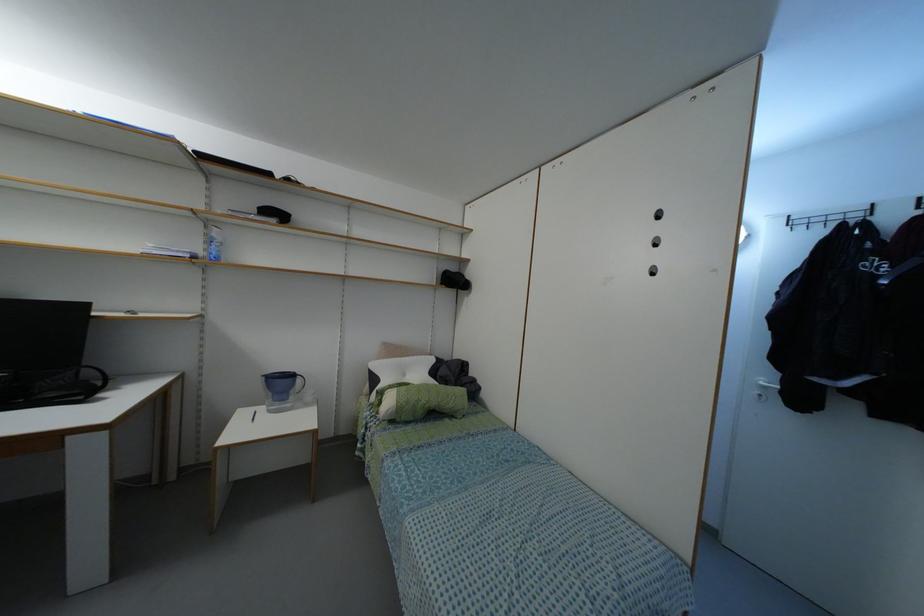
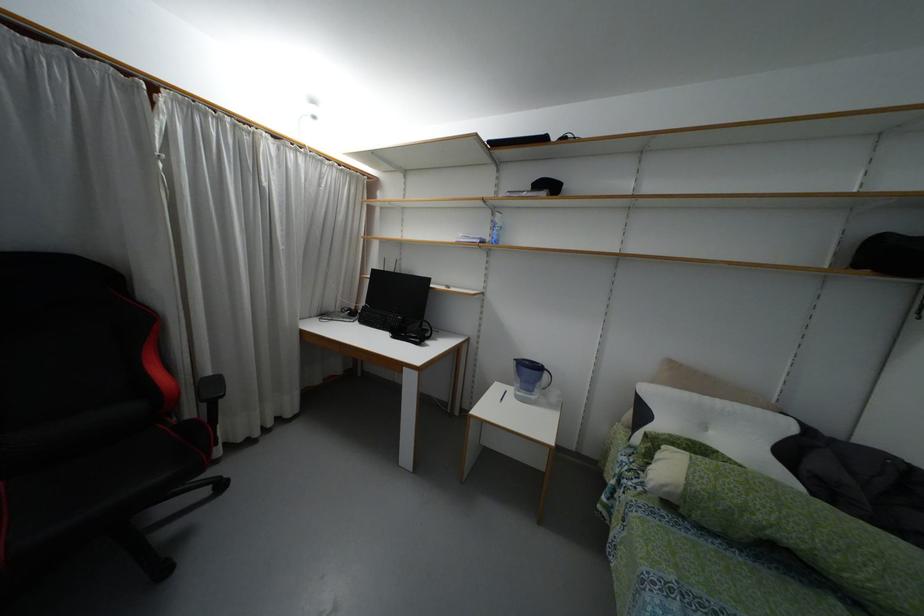
Where in the second image is the point corresponding to point 397,359 from the first image?

(695, 395)